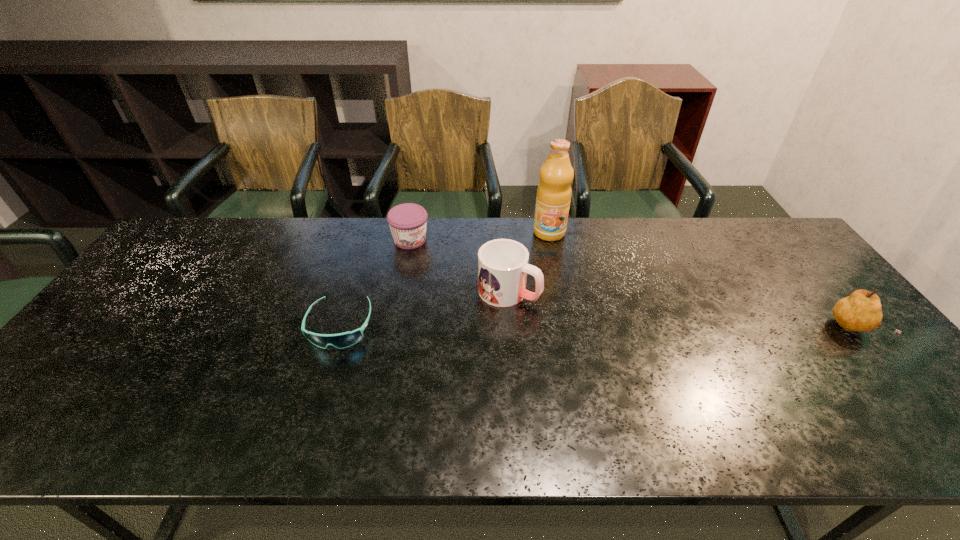
What are the coordinates of `sunglasses` in the screenshot? It's located at [342, 340].

Locate an element on the screen. This screenshot has height=540, width=960. pear is located at coordinates (861, 311).

Locate an element on the screen. Image resolution: width=960 pixels, height=540 pixels. mug is located at coordinates (503, 266).

You are a GUI agent. You are given a task and a screenshot of the screen. Output one action in this format:
    pyautogui.click(x=<x>, y=<y>)
    Task: Click on the fourth tallest object
    
    Given the screenshot: What is the action you would take?
    pyautogui.click(x=408, y=221)

Where is `the fourth object from left to right`? the fourth object from left to right is located at coordinates (554, 191).

Find the location of a particular element. This screenshot has height=540, width=960. fruit juice is located at coordinates (554, 191).

Locate an element on the screen. The height and width of the screenshot is (540, 960). free space located 0.160m on the front-facing side of the sunglasses is located at coordinates (314, 410).

The width and height of the screenshot is (960, 540). What are the coordinates of `vacant area situated on the left of the rightmost object` in the screenshot? It's located at (721, 329).

Find the location of a particular element. The width and height of the screenshot is (960, 540). vacant space situated on the side of the third object from right to left with the handle is located at coordinates (561, 314).

Find the location of a particular element. The image size is (960, 540). vacant space located on the side of the third object from right to left with the handle is located at coordinates (551, 310).